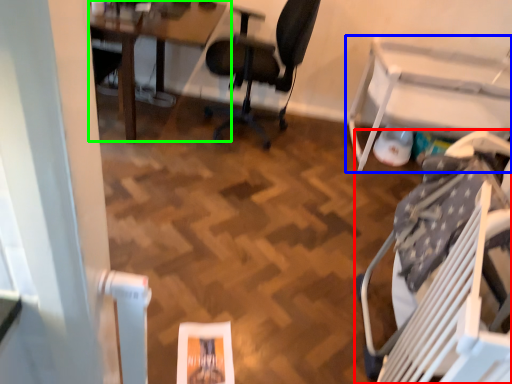
Question: Which object is positioned farthest from chair (highlighted by a red box)? Select from table (highlighted by a blue box) and table (highlighted by a green box).

Choices:
 (A) table
 (B) table

Answer: (B)